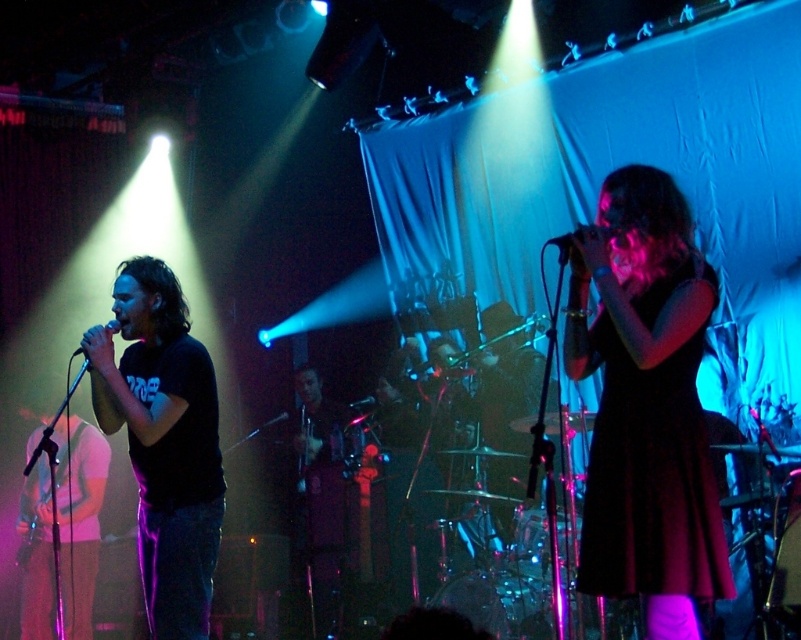
Question: Is the position of black satin dress at center more distant than that of black matte microphone at center?

Choices:
 (A) no
 (B) yes

Answer: (A)

Question: Estimate the real-world distances between objects in this image. Which object is closer to the matte black microphone at left?

Choices:
 (A) pink fabric shirt at left
 (B) black satin dress at center

Answer: (A)

Question: Is pink fabric shirt at left wider than matte black microphone at left?

Choices:
 (A) no
 (B) yes

Answer: (B)

Question: Which point is closer to the camera?

Choices:
 (A) click(x=650, y=528)
 (B) click(x=117, y=324)

Answer: (A)

Question: Is black satin dress at center positioned before matte black shirt at left?

Choices:
 (A) yes
 (B) no

Answer: (A)

Question: Which point appears farthest from the camera in this image?

Choices:
 (A) (149, 576)
 (B) (19, 504)

Answer: (B)